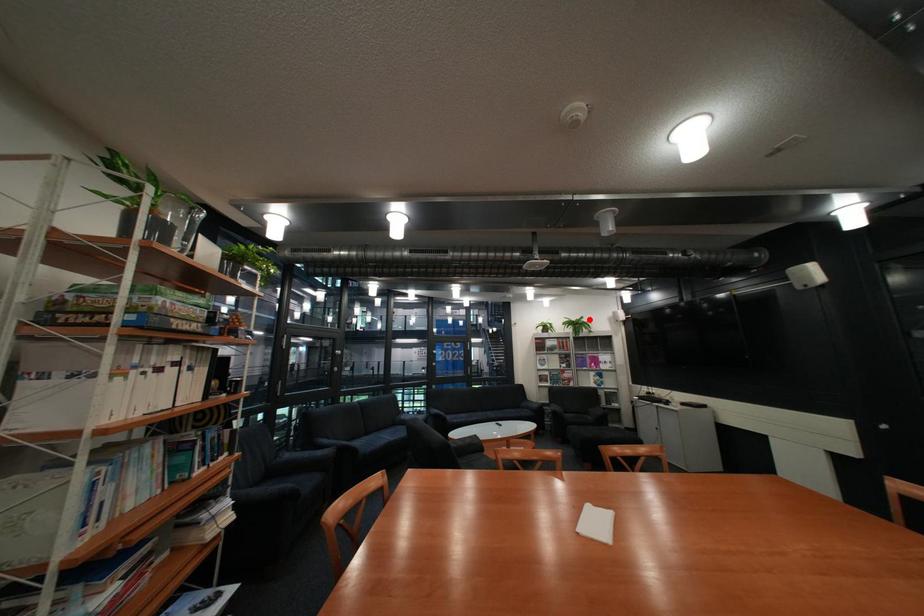
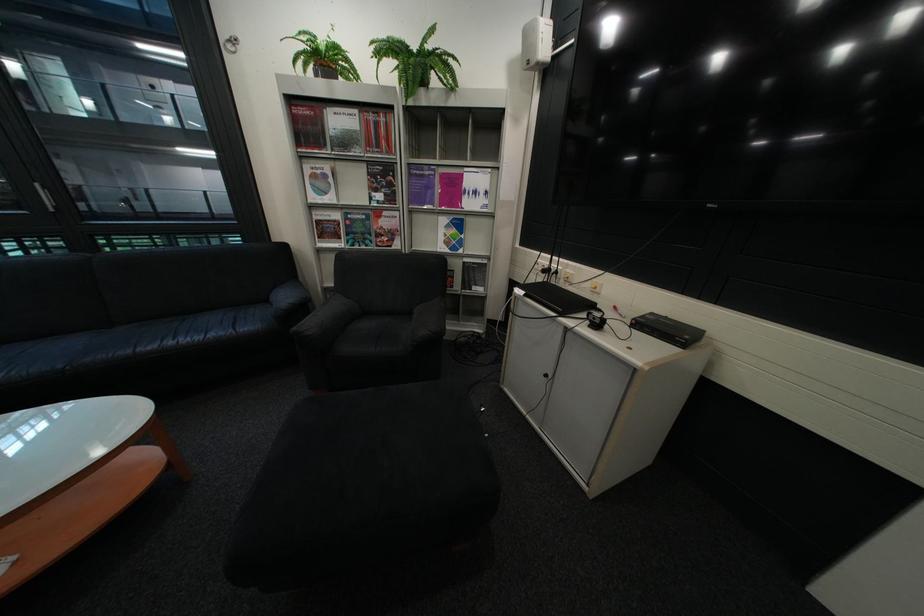
Question: I am providing you with two images of the same scene from different viewpoints. Given a red point in image1, look at the same physical point in image2. Is it:

Choices:
 (A) Closer to the viewpoint
 (B) Farther from the viewpoint

Answer: (A)